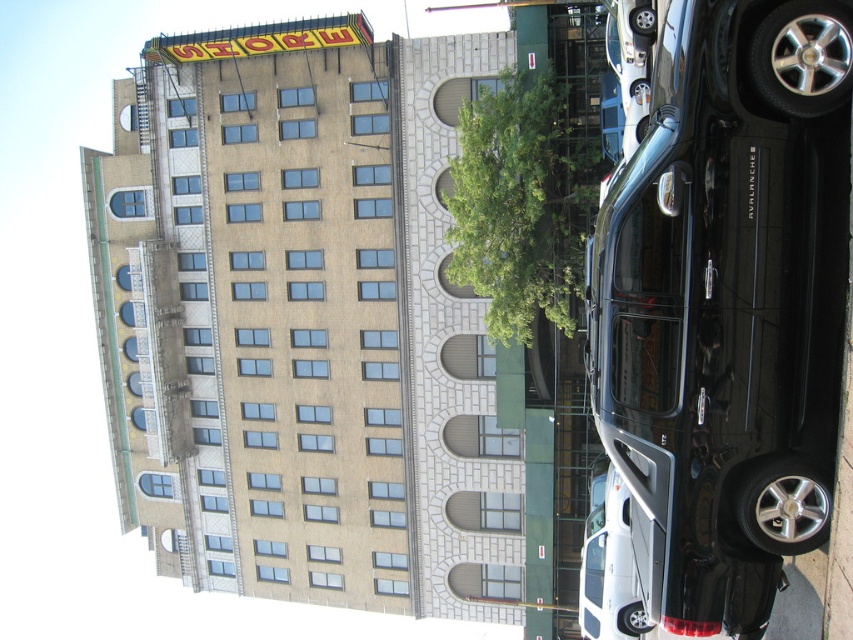
You are a delivery person who needs to park your 5.5 meter long truck between the black glossy suv at right and the green leafy tree at center. Is there enough space between them to fit your truck?

The black glossy suv at right and green leafy tree at center are 8.88 meters apart. Since the truck is 5.5 meters long, there is sufficient space between them to accommodate the truck.

You are a delivery driver who needs to park your vehicle between the black glossy suv at right and the green leafy tree at center. Your vehicle is 1.8 meters wide. Can you fit your vehicle in the space between them?

The black glossy suv at right has a lesser width compared to green leafy tree at center. Since the SUV is narrower than the tree, the space between them might be sufficient. However, without knowing the exact distance between the two objects, it is impossible to determine if your 1.8 meter wide vehicle can fit. Please check the actual space available.